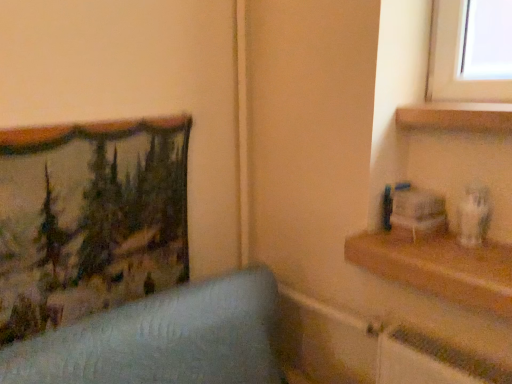
Question: Is textured fabric picture frame at left positioned with its back to wooden shelf at upper right, the 2th shelf when ordered from bottom to top?

Choices:
 (A) no
 (B) yes

Answer: (A)

Question: Does textured fabric picture frame at left appear on the right side of wooden shelf at upper right, arranged as the first shelf when viewed from the top?

Choices:
 (A) no
 (B) yes

Answer: (A)

Question: From a real-world perspective, is textured fabric picture frame at left below wooden shelf at upper right, the 2th shelf when ordered from bottom to top?

Choices:
 (A) no
 (B) yes

Answer: (B)

Question: Does textured fabric picture frame at left have a greater width compared to wooden shelf at upper right, arranged as the first shelf when viewed from the top?

Choices:
 (A) yes
 (B) no

Answer: (B)

Question: Considering the relative sizes of textured fabric picture frame at left and wooden shelf at upper right, the 2th shelf when ordered from bottom to top, in the image provided, is textured fabric picture frame at left thinner than wooden shelf at upper right, the 2th shelf when ordered from bottom to top,?

Choices:
 (A) yes
 (B) no

Answer: (A)

Question: Considering the relative sizes of textured fabric picture frame at left and wooden shelf at upper right, the 2th shelf when ordered from bottom to top, in the image provided, is textured fabric picture frame at left shorter than wooden shelf at upper right, the 2th shelf when ordered from bottom to top,?

Choices:
 (A) yes
 (B) no

Answer: (B)

Question: Is wooden shelf at upper right, arranged as the first shelf when viewed from the top, looking in the opposite direction of wooden shelf at right, which is the 1th shelf from bottom to top?

Choices:
 (A) yes
 (B) no

Answer: (B)

Question: From the image's perspective, does wooden shelf at upper right, arranged as the first shelf when viewed from the top, appear higher than wooden shelf at right, which is the 1th shelf from bottom to top?

Choices:
 (A) no
 (B) yes

Answer: (B)

Question: Considering the relative sizes of wooden shelf at upper right, arranged as the first shelf when viewed from the top, and wooden shelf at right, the second shelf when ordered from top to bottom, in the image provided, is wooden shelf at upper right, arranged as the first shelf when viewed from the top, shorter than wooden shelf at right, the second shelf when ordered from top to bottom,?

Choices:
 (A) yes
 (B) no

Answer: (A)

Question: From a real-world perspective, is wooden shelf at upper right, the 2th shelf when ordered from bottom to top, over wooden shelf at right, the second shelf when ordered from top to bottom?

Choices:
 (A) no
 (B) yes

Answer: (B)

Question: Are wooden shelf at upper right, the 2th shelf when ordered from bottom to top, and wooden shelf at right, the second shelf when ordered from top to bottom, making contact?

Choices:
 (A) no
 (B) yes

Answer: (A)

Question: Is wooden shelf at upper right, arranged as the first shelf when viewed from the top, not close to wooden shelf at right, the second shelf when ordered from top to bottom?

Choices:
 (A) yes
 (B) no

Answer: (B)

Question: Does wooden shelf at right, the second shelf when ordered from top to bottom, have a lesser width compared to wooden shelf at upper right, the 2th shelf when ordered from bottom to top?

Choices:
 (A) no
 (B) yes

Answer: (A)